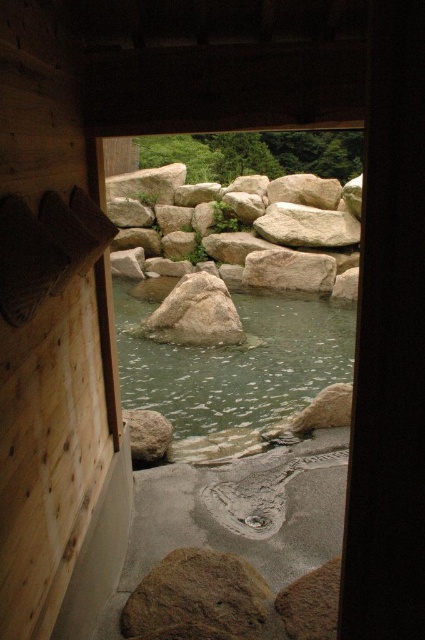
Question: Estimate the real-world distances between objects in this image. Which object is farther from the smooth gray rock at lower left?

Choices:
 (A) brown rough rock at lower center
 (B) green stone river at center

Answer: (B)

Question: Which point appears closest to the camera in this image?

Choices:
 (A) (218, 387)
 (B) (201, 282)
 (C) (229, 624)
 (D) (141, 435)

Answer: (C)

Question: Can you confirm if green stone river at center is smaller than smooth gray rock at center?

Choices:
 (A) yes
 (B) no

Answer: (A)

Question: Which object is the farthest from the smooth gray rock at lower left?

Choices:
 (A) green stone river at center
 (B) brown rough rock at lower center
 (C) smooth gray rock at center

Answer: (A)

Question: Is green stone river at center to the left of smooth gray rock at lower left from the viewer's perspective?

Choices:
 (A) no
 (B) yes

Answer: (A)

Question: Does green stone river at center have a larger size compared to brown rough rock at lower center?

Choices:
 (A) no
 (B) yes

Answer: (A)